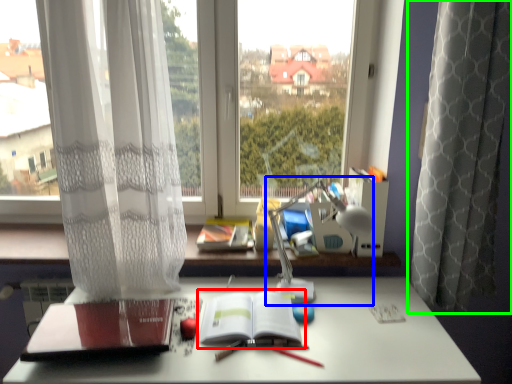
Question: Which object is positioned farthest from paperback book (highlighted by a red box)? Select from table lamp (highlighted by a blue box) and curtain (highlighted by a green box).

Choices:
 (A) table lamp
 (B) curtain

Answer: (B)